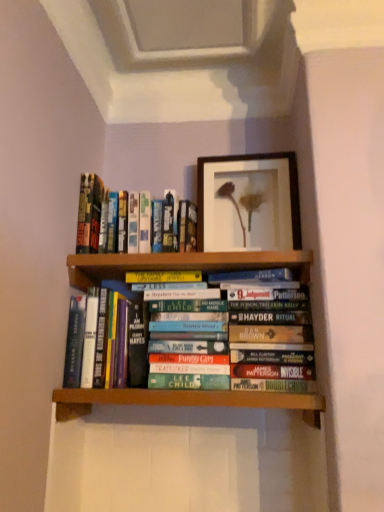
You are a GUI agent. You are given a task and a screenshot of the screen. Output one action in this format:
    pyautogui.click(x=<x>, y=<y>)
    Task: Click on the hardcover book at center, positioned as the 2th book in top-to-bottom order
    
    Given the screenshot: What is the action you would take?
    pyautogui.click(x=106, y=338)

Considering the sizes of objects hardcover books at upper left, the second book positioned from the bottom, and hardcover book at center, positioned as the 2th book in top-to-bottom order, in the image provided, who is taller, hardcover books at upper left, the second book positioned from the bottom, or hardcover book at center, positioned as the 2th book in top-to-bottom order,?

Standing taller between the two is hardcover book at center, positioned as the 2th book in top-to-bottom order.

In the scene shown: Which object is thinner, hardcover books at upper left, the second book positioned from the bottom, or hardcover book at center, the first book when ordered from bottom to top?

With smaller width is hardcover books at upper left, the second book positioned from the bottom.

Is hardcover books at upper left, the 1th book viewed from the top, not inside hardcover book at center, positioned as the 2th book in top-to-bottom order?

Absolutely, hardcover books at upper left, the 1th book viewed from the top, is external to hardcover book at center, positioned as the 2th book in top-to-bottom order.

From the image's perspective, which one is positioned higher, hardcover books at upper left, the 1th book viewed from the top, or hardcover book at center, positioned as the 2th book in top-to-bottom order?

hardcover books at upper left, the 1th book viewed from the top, is shown above in the image.

From the image's perspective, is hardcover book at center, the first book when ordered from bottom to top, under wooden framed picture at upper center?

Yes, from the image's perspective, hardcover book at center, the first book when ordered from bottom to top, is below wooden framed picture at upper center.

From a real-world perspective, is hardcover book at center, the first book when ordered from bottom to top, positioned above or below wooden framed picture at upper center?

In terms of real-world spatial position, hardcover book at center, the first book when ordered from bottom to top, is below wooden framed picture at upper center.

Considering the positions of objects hardcover book at center, positioned as the 2th book in top-to-bottom order, and wooden framed picture at upper center in the image provided, who is more to the left, hardcover book at center, positioned as the 2th book in top-to-bottom order, or wooden framed picture at upper center?

Positioned to the left is hardcover book at center, positioned as the 2th book in top-to-bottom order.

Which is more to the left, wooden framed picture at upper center or hardcover book at center, the first book when ordered from bottom to top?

hardcover book at center, the first book when ordered from bottom to top.

From the image's perspective, between wooden framed picture at upper center and hardcover book at center, the first book when ordered from bottom to top, who is located below?

hardcover book at center, the first book when ordered from bottom to top, is shown below in the image.

How distant is wooden framed picture at upper center from hardcover book at center, positioned as the 2th book in top-to-bottom order?

wooden framed picture at upper center and hardcover book at center, positioned as the 2th book in top-to-bottom order, are 15.78 inches apart.

Between wooden framed picture at upper center and hardcover book at center, positioned as the 2th book in top-to-bottom order, which one has more height?

wooden framed picture at upper center is taller.

From the image's perspective, is hardcover books at upper left, the 1th book viewed from the top, located beneath wooden framed picture at upper center?

Correct, hardcover books at upper left, the 1th book viewed from the top, appears lower than wooden framed picture at upper center in the image.

Measure the distance between hardcover books at upper left, the second book positioned from the bottom, and wooden framed picture at upper center.

hardcover books at upper left, the second book positioned from the bottom, is 10.33 inches away from wooden framed picture at upper center.

Does point (108, 244) lie behind point (275, 236)?

No.

Is hardcover books at upper left, the second book positioned from the bottom, to the left of wooden framed picture at upper center from the viewer's perspective?

Indeed, hardcover books at upper left, the second book positioned from the bottom, is positioned on the left side of wooden framed picture at upper center.

Image resolution: width=384 pixels, height=512 pixels. Find the location of `picture frame behind the hardcover books at upper left, the 1th book viewed from the top`. picture frame behind the hardcover books at upper left, the 1th book viewed from the top is located at coordinates (248, 203).

From their relative heights in the image, would you say wooden framed picture at upper center is taller or shorter than hardcover books at upper left, the second book positioned from the bottom?

Considering their sizes, wooden framed picture at upper center has more height than hardcover books at upper left, the second book positioned from the bottom.

Can you tell me how much wooden framed picture at upper center and hardcover books at upper left, the 1th book viewed from the top, differ in facing direction?

They differ by 0.546 degrees in their facing directions.

Which of these two, wooden framed picture at upper center or hardcover books at upper left, the 1th book viewed from the top, is thinner?

wooden framed picture at upper center is thinner.

Is hardcover book at center, positioned as the 2th book in top-to-bottom order, at the left side of hardcover books at upper left, the second book positioned from the bottom?

Yes, hardcover book at center, positioned as the 2th book in top-to-bottom order, is to the left of hardcover books at upper left, the second book positioned from the bottom.

From a real-world perspective, is hardcover book at center, the first book when ordered from bottom to top, over hardcover books at upper left, the 1th book viewed from the top?

Incorrect, from a real-world perspective, hardcover book at center, the first book when ordered from bottom to top, is lower than hardcover books at upper left, the 1th book viewed from the top.

Which object is wider, hardcover book at center, the first book when ordered from bottom to top, or hardcover books at upper left, the 1th book viewed from the top?

Wider between the two is hardcover book at center, the first book when ordered from bottom to top.

Consider the image. From the image's perspective, is hardcover book at center, the first book when ordered from bottom to top, positioned above or below hardcover books at upper left, the 1th book viewed from the top?

hardcover book at center, the first book when ordered from bottom to top, is situated lower than hardcover books at upper left, the 1th book viewed from the top, in the image.

The image size is (384, 512). There is a hardcover book at center, the first book when ordered from bottom to top. Identify the location of book above it (from a real-world perspective). (96, 217).

Locate an element on the screen. This screenshot has width=384, height=512. picture frame behind the hardcover book at center, the first book when ordered from bottom to top is located at coordinates (248, 203).

Considering their positions, is wooden framed picture at upper center positioned closer to hardcover books at upper left, the second book positioned from the bottom, than hardcover book at center, positioned as the 2th book in top-to-bottom order?

hardcover book at center, positioned as the 2th book in top-to-bottom order, lies closer to hardcover books at upper left, the second book positioned from the bottom, than the other object.

Looking at the image, which one is located further to hardcover books at upper left, the 1th book viewed from the top, hardcover book at center, the first book when ordered from bottom to top, or wooden framed picture at upper center?

Based on the image, wooden framed picture at upper center appears to be further to hardcover books at upper left, the 1th book viewed from the top.

Which object lies nearer to the anchor point wooden framed picture at upper center, hardcover book at center, positioned as the 2th book in top-to-bottom order, or hardcover books at upper left, the second book positioned from the bottom?

The object closer to wooden framed picture at upper center is hardcover books at upper left, the second book positioned from the bottom.

Estimate the real-world distances between objects in this image. Which object is further from wooden framed picture at upper center, hardcover books at upper left, the 1th book viewed from the top, or hardcover book at center, positioned as the 2th book in top-to-bottom order?

The object further to wooden framed picture at upper center is hardcover book at center, positioned as the 2th book in top-to-bottom order.

When comparing their distances from hardcover book at center, the first book when ordered from bottom to top, does hardcover books at upper left, the 1th book viewed from the top, or wooden framed picture at upper center seem further?

wooden framed picture at upper center is further to hardcover book at center, the first book when ordered from bottom to top.

Based on their spatial positions, is wooden framed picture at upper center or hardcover books at upper left, the second book positioned from the bottom, closer to hardcover book at center, positioned as the 2th book in top-to-bottom order?

hardcover books at upper left, the second book positioned from the bottom, lies closer to hardcover book at center, positioned as the 2th book in top-to-bottom order, than the other object.

The image size is (384, 512). What are the coordinates of `book between hardcover book at center, positioned as the 2th book in top-to-bottom order, and wooden framed picture at upper center` in the screenshot? It's located at (96, 217).